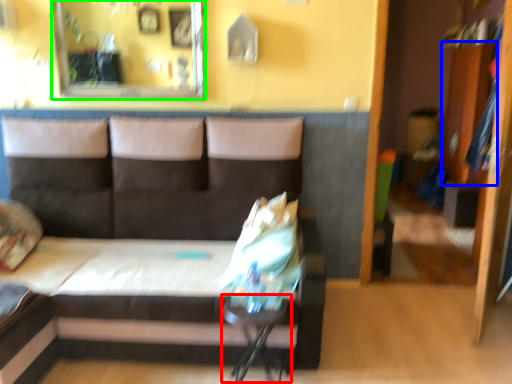
Question: Based on their relative distances, which object is nearer to table (highlighted by a red box)? Choose from dresser (highlighted by a blue box) and mirror (highlighted by a green box).

Choices:
 (A) dresser
 (B) mirror

Answer: (B)